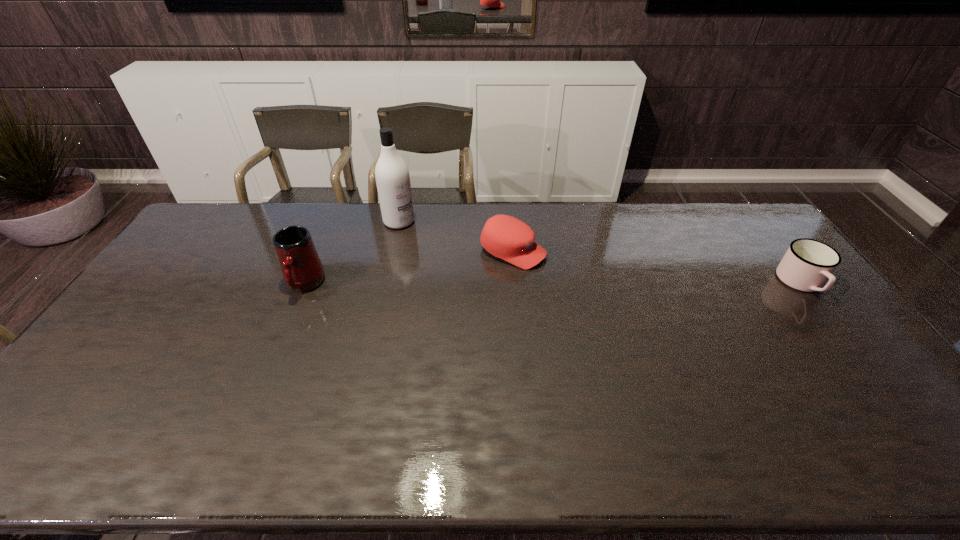
Find the location of `free space between the right mug and the cap`. free space between the right mug and the cap is located at coordinates (658, 267).

This screenshot has height=540, width=960. I want to click on unoccupied area between the farthest object and the cap, so click(456, 237).

Where is `the third closest object relative to the rightmost object`? The height and width of the screenshot is (540, 960). the third closest object relative to the rightmost object is located at coordinates (302, 269).

Locate an element on the screen. the second closest object to the leftmost object is located at coordinates (508, 238).

You are a GUI agent. You are given a task and a screenshot of the screen. Output one action in this format:
    pyautogui.click(x=<x>, y=<y>)
    Task: Click on the vacant region that satisfies the following two spatial constraints: 1. on the front side of the farthest object; 2. on the right side of the second object from right to left
    
    Given the screenshot: What is the action you would take?
    pyautogui.click(x=393, y=251)